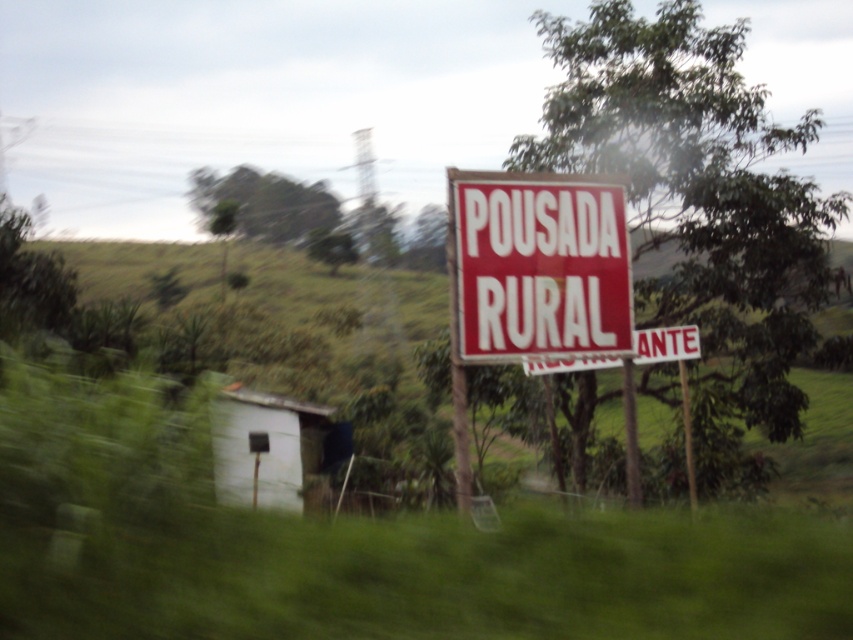
Question: Which is farther from the green leafy tree at upper right?

Choices:
 (A) red matte sign at center
 (B) white matte hut at lower left

Answer: (B)

Question: From the image, what is the correct spatial relationship of red matte sign at center in relation to white matte hut at lower left?

Choices:
 (A) left
 (B) right

Answer: (B)

Question: Can you confirm if red matte sign at center is thinner than white matte hut at lower left?

Choices:
 (A) no
 (B) yes

Answer: (B)

Question: Which point appears closest to the camera in this image?

Choices:
 (A) (300, 502)
 (B) (734, 228)

Answer: (B)

Question: Which point is farther to the camera?

Choices:
 (A) (601, 216)
 (B) (701, 186)
 (C) (321, 444)

Answer: (C)

Question: Is green leafy tree at upper right below red matte sign at center?

Choices:
 (A) yes
 (B) no

Answer: (B)